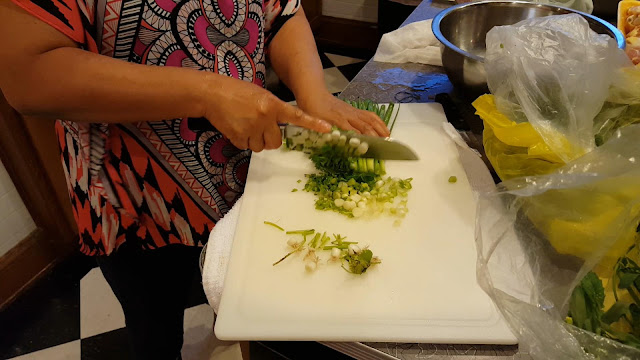
The width and height of the screenshot is (640, 360). Find the location of `plastic cover`. plastic cover is located at coordinates (543, 340).